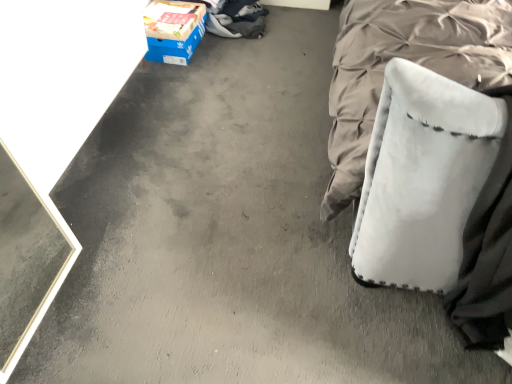
Identify the location of vacant area that lies to the right of blue cardboard box at upper left. The width and height of the screenshot is (512, 384). (225, 54).